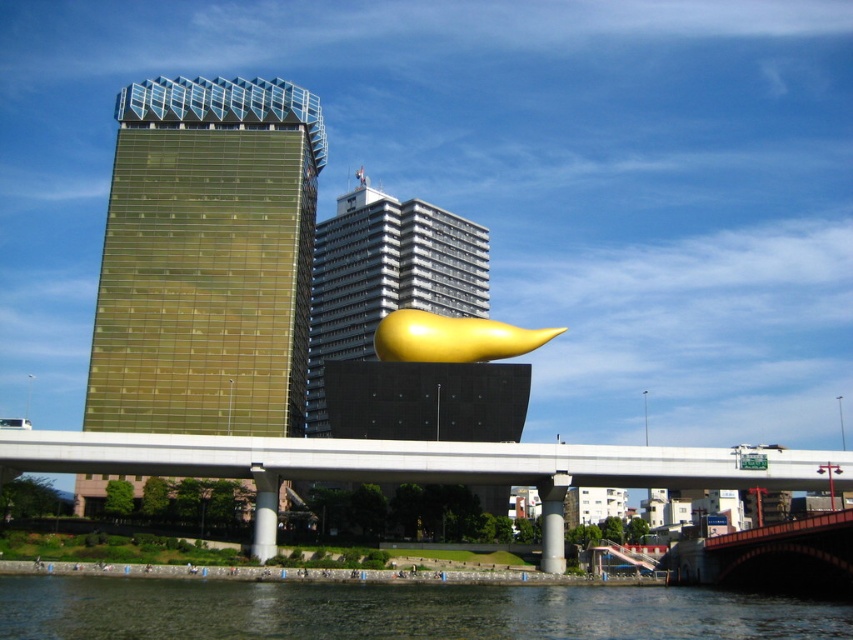
Question: Does gold reflective glass tower at left come behind greenish water at lower center?

Choices:
 (A) yes
 (B) no

Answer: (A)

Question: Estimate the real-world distances between objects in this image. Which object is farther from the gold reflective tower at center?

Choices:
 (A) gold reflective glass tower at left
 (B) greenish water at lower center

Answer: (B)

Question: Which is nearer to the concrete bridge at center?

Choices:
 (A) gold reflective tower at center
 (B) greenish water at lower center

Answer: (B)

Question: Does gold reflective glass tower at left lie in front of gold reflective tower at center?

Choices:
 (A) no
 (B) yes

Answer: (B)

Question: Does greenish water at lower center appear on the right side of gold reflective tower at center?

Choices:
 (A) no
 (B) yes

Answer: (B)

Question: Which point is closer to the camera?

Choices:
 (A) (241, 132)
 (B) (361, 634)

Answer: (B)